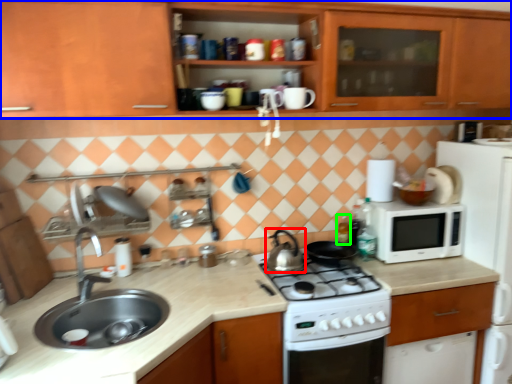
Question: Which is farther away from kitchen appliance (highlighted by a red box)? cabinetry (highlighted by a blue box) or bottle (highlighted by a green box)?

Choices:
 (A) cabinetry
 (B) bottle

Answer: (A)